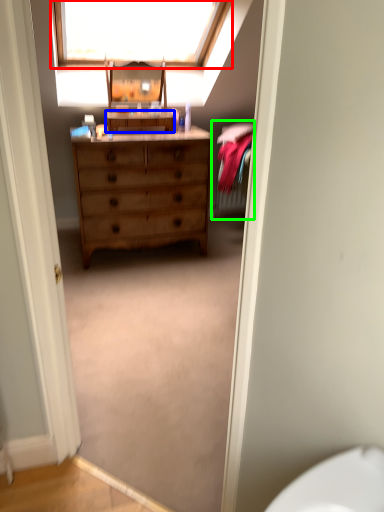
Question: Estimate the real-world distances between objects in this image. Which object is closer to window (highlighted by a red box), cabinetry (highlighted by a blue box) or bed (highlighted by a green box)?

Choices:
 (A) cabinetry
 (B) bed

Answer: (A)